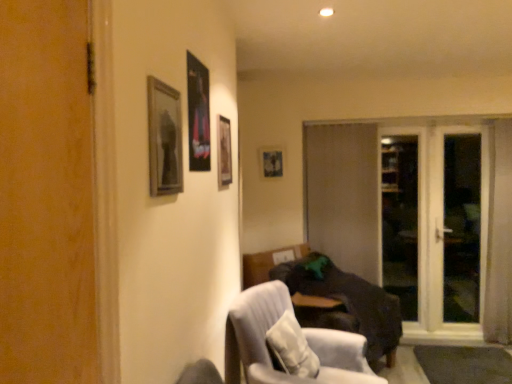
Question: Considering the relative positions of white textured pillow at lower center and metallic poster at upper center, positioned as the 2th picture frame in left-to-right order, in the image provided, is white textured pillow at lower center to the left of metallic poster at upper center, positioned as the 2th picture frame in left-to-right order, from the viewer's perspective?

Choices:
 (A) no
 (B) yes

Answer: (A)

Question: From the image's perspective, would you say white textured pillow at lower center is positioned over metallic poster at upper center, arranged as the second picture frame when viewed from the front?

Choices:
 (A) yes
 (B) no

Answer: (B)

Question: Does white textured pillow at lower center have a lesser height compared to metallic poster at upper center, the third picture frame in the back-to-front sequence?

Choices:
 (A) no
 (B) yes

Answer: (B)

Question: Is the position of white textured pillow at lower center more distant than that of metallic poster at upper center, the third picture frame in the back-to-front sequence?

Choices:
 (A) no
 (B) yes

Answer: (B)

Question: Can you confirm if white textured pillow at lower center is wider than metallic poster at upper center, which is the third picture frame from right to left?

Choices:
 (A) no
 (B) yes

Answer: (B)

Question: Is white textured pillow at lower center touching metallic poster at upper center, which is the third picture frame from right to left?

Choices:
 (A) yes
 (B) no

Answer: (B)

Question: Can you confirm if wooden frame at upper left, which is the 1th picture frame in left-to-right order, is bigger than metallic poster at upper center, the third picture frame in the back-to-front sequence?

Choices:
 (A) yes
 (B) no

Answer: (A)

Question: Can you confirm if wooden frame at upper left, which ranks as the fourth picture frame in back-to-front order, is positioned to the left of metallic poster at upper center, positioned as the 2th picture frame in left-to-right order?

Choices:
 (A) yes
 (B) no

Answer: (A)

Question: From the image's perspective, would you say wooden frame at upper left, the fourth picture frame positioned from the right, is shown under metallic poster at upper center, the third picture frame in the back-to-front sequence?

Choices:
 (A) no
 (B) yes

Answer: (B)

Question: Is wooden frame at upper left, which ranks as the fourth picture frame in back-to-front order, oriented towards metallic poster at upper center, positioned as the 2th picture frame in left-to-right order?

Choices:
 (A) no
 (B) yes

Answer: (A)

Question: Are wooden frame at upper left, which ranks as the fourth picture frame in back-to-front order, and metallic poster at upper center, the third picture frame in the back-to-front sequence, making contact?

Choices:
 (A) no
 (B) yes

Answer: (A)

Question: Does wooden frame at upper left, the fourth picture frame positioned from the right, have a lesser width compared to metallic poster at upper center, which is the third picture frame from right to left?

Choices:
 (A) yes
 (B) no

Answer: (B)

Question: Is brown matte door at center not within dark brown fabric couch at lower right?

Choices:
 (A) yes
 (B) no

Answer: (A)